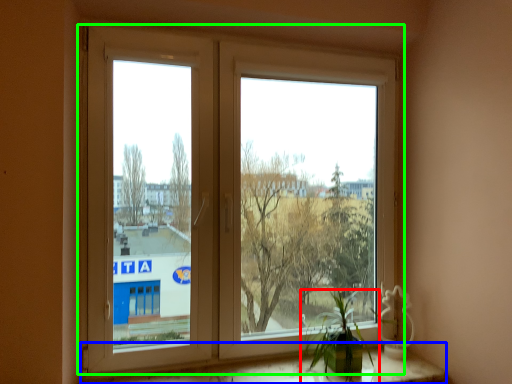
Question: Estimate the real-world distances between objects in this image. Which object is farther from houseplant (highlighted by a red box), window sill (highlighted by a blue box) or window (highlighted by a green box)?

Choices:
 (A) window sill
 (B) window

Answer: (B)